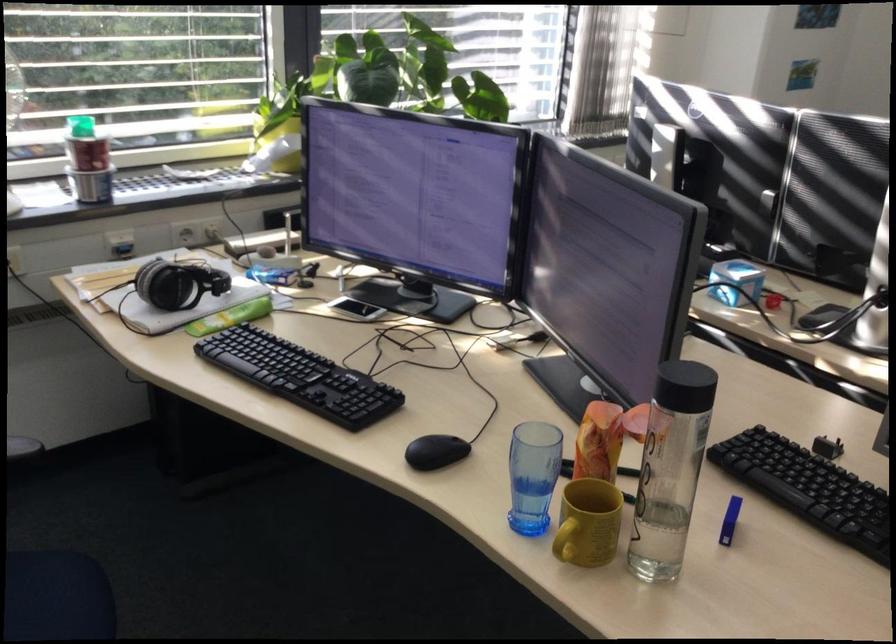
What do you see at coordinates (435, 451) in the screenshot?
I see `the black bottle cap` at bounding box center [435, 451].